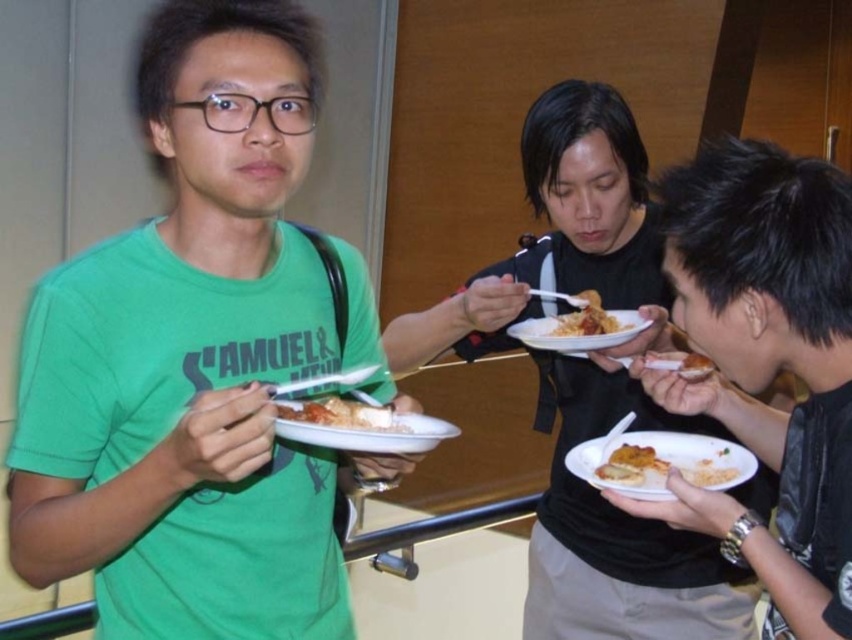
Is shiny plastic fork at center to the right of golden crispy pastry at center from the viewer's perspective?

In fact, shiny plastic fork at center is to the left of golden crispy pastry at center.

Does shiny plastic fork at center have a larger size compared to golden crispy pastry at center?

Correct, shiny plastic fork at center is larger in size than golden crispy pastry at center.

At what (x,y) coordinates should I click in order to perform the action: click on shiny plastic fork at center. Please return your answer as a coordinate pair (x, y). This screenshot has width=852, height=640. Looking at the image, I should click on (583, 316).

I want to click on shiny plastic fork at center, so click(583, 316).

Which is more to the right, green matte t-shirt at left or white matte plate at lower right?

From the viewer's perspective, white matte plate at lower right appears more on the right side.

Can you confirm if green matte t-shirt at left is smaller than white matte plate at lower right?

Incorrect, green matte t-shirt at left is not smaller in size than white matte plate at lower right.

Does point (242, 296) come behind point (580, 468)?

No, it is in front of (580, 468).

Find the location of a particular element. green matte t-shirt at left is located at coordinates pyautogui.click(x=196, y=358).

Can you confirm if white paper plate at center is positioned to the left of golden crispy bread at center?

Yes, white paper plate at center is to the left of golden crispy bread at center.

Does point (275, 433) lie in front of point (684, 362)?

Yes, point (275, 433) is in front of point (684, 362).

Where is `white paper plate at center`? white paper plate at center is located at coordinates (371, 435).